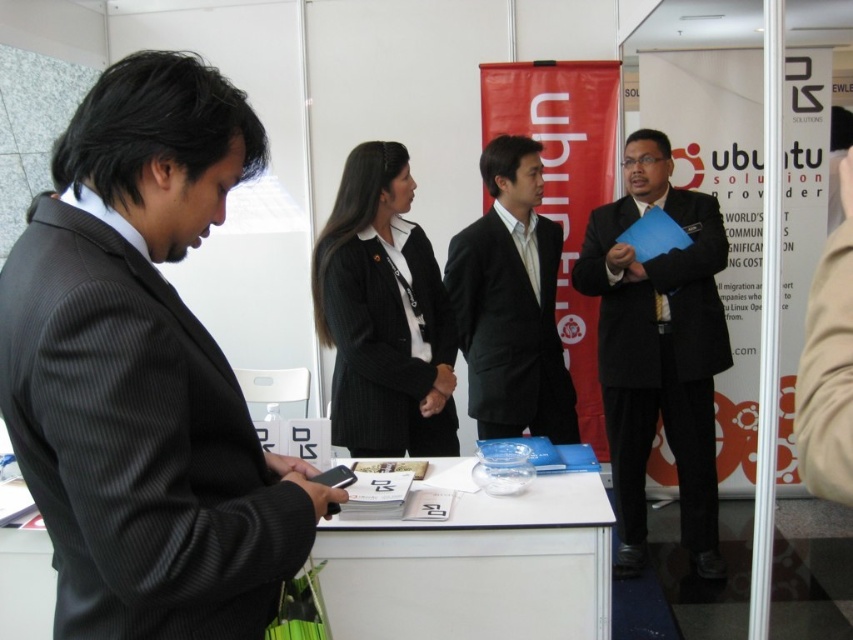
Describe the element at coordinates (659, 349) in the screenshot. I see `matte black suit at center` at that location.

Does matte black suit at center appear under black ribbed blazer at center?

Yes.

The width and height of the screenshot is (853, 640). Find the location of `matte black suit at center`. matte black suit at center is located at coordinates (659, 349).

At what (x,y) coordinates should I click in order to perform the action: click on matte black suit at center. Please return your answer as a coordinate pair (x, y). The height and width of the screenshot is (640, 853). Looking at the image, I should click on (659, 349).

Is matte black suit at center closer to camera compared to black suit at center?

No, matte black suit at center is further to the viewer.

Where is `matte black suit at center`? This screenshot has height=640, width=853. matte black suit at center is located at coordinates (659, 349).

Measure the distance between matte black suit at center and camera.

The distance of matte black suit at center from camera is 9.47 feet.

Identify the location of matte black suit at center. (659, 349).

Between point (82, 324) and point (399, 148), which one is positioned in front?

Point (82, 324)

Consider the image. Is black pinstripe suit at left below black ribbed blazer at center?

Correct, black pinstripe suit at left is located below black ribbed blazer at center.

Does point (35, 260) lie behind point (364, 195)?

No, it is in front of (364, 195).

Locate an element on the screen. This screenshot has width=853, height=640. black pinstripe suit at left is located at coordinates (144, 372).